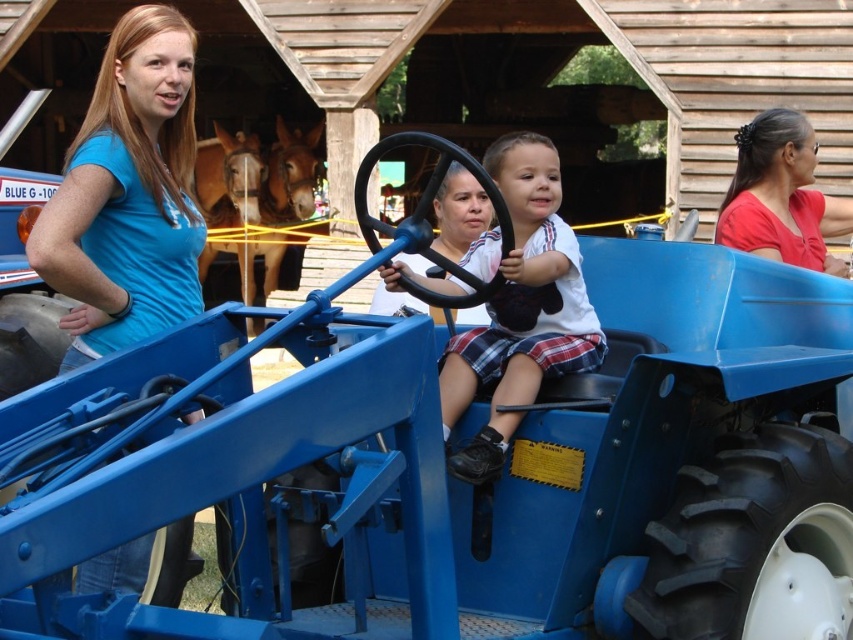
In the scene shown: You are standing at the point with coordinates point (519, 307). What object are you standing on?

The point (519, 307) corresponds to the matte blue tractor at center, so you are standing on the matte blue tractor at center.

You are a photographer at the fair. You need to take a photo of the matte blue tractor at center and the matte red shirt at right. Which object should be placed closer to the camera to ensure both appear in focus?

The matte blue tractor at center is smaller in size compared to the matte red shirt at right. To ensure both appear in focus, the matte red shirt at right should be placed closer to the camera since larger objects require less depth of field adjustment.